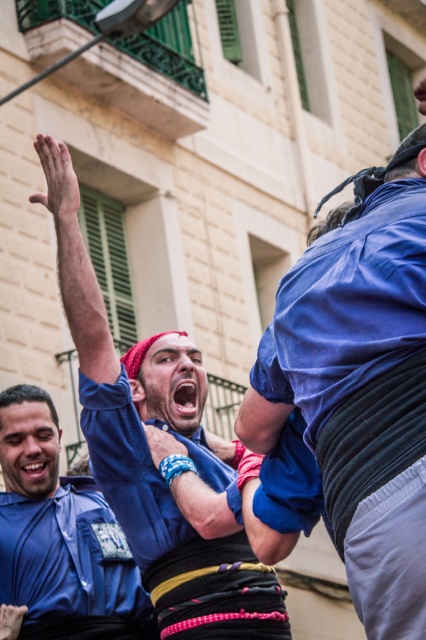
Between blue fabric shirt at upper right and blue cotton shirt at lower left, which one appears on the right side from the viewer's perspective?

From the viewer's perspective, blue fabric shirt at upper right appears more on the right side.

This screenshot has height=640, width=426. What do you see at coordinates (359, 392) in the screenshot?
I see `blue fabric shirt at upper right` at bounding box center [359, 392].

This screenshot has width=426, height=640. What are the coordinates of `blue fabric shirt at upper right` in the screenshot? It's located at (359, 392).

How much distance is there between blue cotton shirt at upper left and blue cotton shirt at lower left?

blue cotton shirt at upper left and blue cotton shirt at lower left are 6.10 meters apart from each other.

Who is more forward, (48,163) or (58,627)?

Point (58,627)

Between point (103, 356) and point (91, 557), which one is positioned in front?

Point (103, 356)

Locate an element on the screen. blue cotton shirt at upper left is located at coordinates [147, 445].

Locate an element on the screen. blue fabric shirt at upper right is located at coordinates (359, 392).

Does blue fabric shirt at upper right have a greater height compared to blue cotton shirt at upper left?

No.

Between point (305, 252) and point (146, 390), which one is positioned in front?

Positioned in front is point (146, 390).

Locate an element on the screen. blue fabric shirt at upper right is located at coordinates (359, 392).